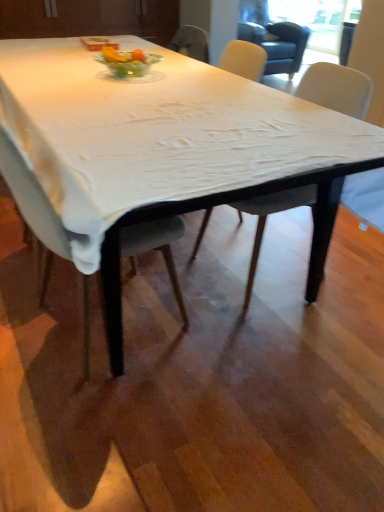
Where is `free location in front of matte gray chair at center, marked as the 1th chair in a left-to-right arrangement`? This screenshot has height=512, width=384. free location in front of matte gray chair at center, marked as the 1th chair in a left-to-right arrangement is located at coordinates (104, 422).